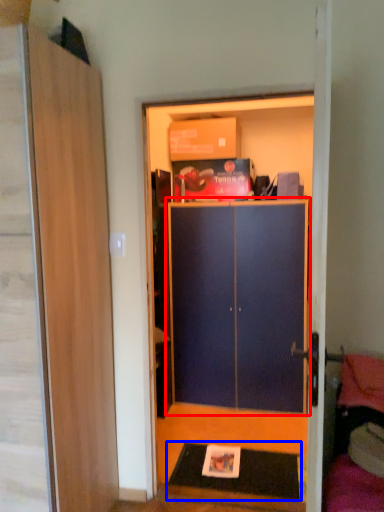
Question: Which of the following is the farthest to the observer, cabinetry (highlighted by a red box) or doormat (highlighted by a blue box)?

Choices:
 (A) cabinetry
 (B) doormat

Answer: (A)